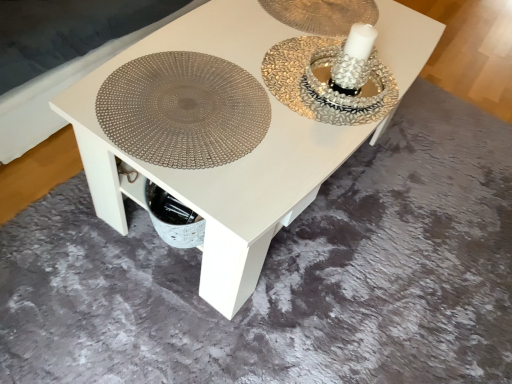
Question: Is white glossy table at center turned away from matte silver platter at center?

Choices:
 (A) no
 (B) yes

Answer: (A)

Question: From a real-world perspective, is white glossy table at center located beneath matte silver platter at center?

Choices:
 (A) no
 (B) yes

Answer: (B)

Question: Considering the relative sizes of white glossy table at center and matte silver platter at center in the image provided, is white glossy table at center smaller than matte silver platter at center?

Choices:
 (A) no
 (B) yes

Answer: (A)

Question: Considering the relative sizes of white glossy table at center and matte silver platter at center in the image provided, is white glossy table at center taller than matte silver platter at center?

Choices:
 (A) no
 (B) yes

Answer: (B)

Question: From the image's perspective, is white glossy table at center under matte silver platter at center?

Choices:
 (A) yes
 (B) no

Answer: (B)

Question: Can you confirm if white glossy table at center is shorter than matte silver platter at center?

Choices:
 (A) no
 (B) yes

Answer: (A)

Question: From the image's perspective, is matte silver platter at center located beneath white glossy table at center?

Choices:
 (A) no
 (B) yes

Answer: (B)

Question: Can you confirm if matte silver platter at center is wider than white glossy table at center?

Choices:
 (A) no
 (B) yes

Answer: (A)

Question: Considering the relative positions of matte silver platter at center and white glossy table at center in the image provided, is matte silver platter at center to the left of white glossy table at center from the viewer's perspective?

Choices:
 (A) no
 (B) yes

Answer: (B)

Question: Can you confirm if matte silver platter at center is shorter than white glossy table at center?

Choices:
 (A) yes
 (B) no

Answer: (A)

Question: From the image's perspective, is matte silver platter at center located above white glossy table at center?

Choices:
 (A) no
 (B) yes

Answer: (A)

Question: Is matte silver platter at center further to camera compared to white glossy table at center?

Choices:
 (A) no
 (B) yes

Answer: (B)

Question: From a real-world perspective, is white glossy table at center positioned above or below matte silver platter at center?

Choices:
 (A) below
 (B) above

Answer: (A)